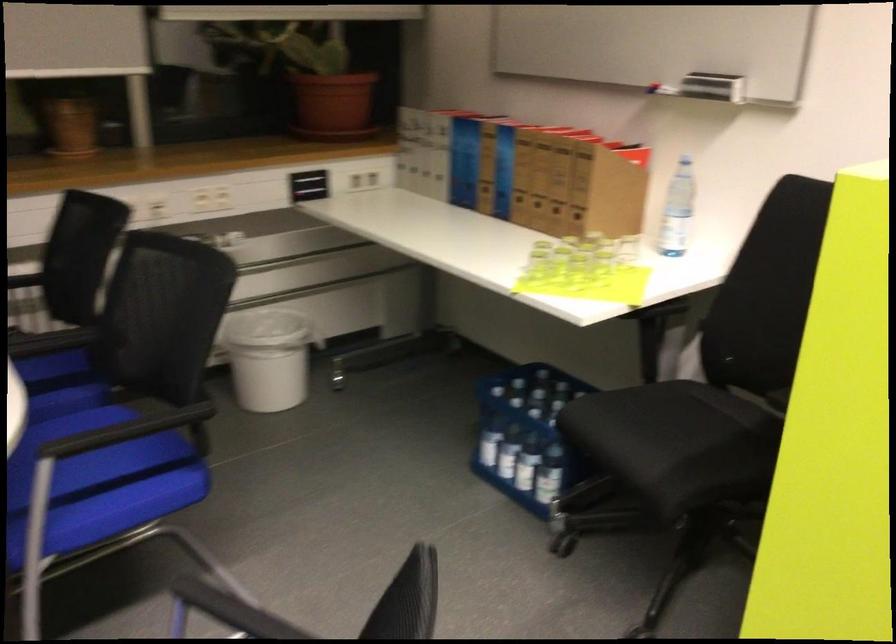
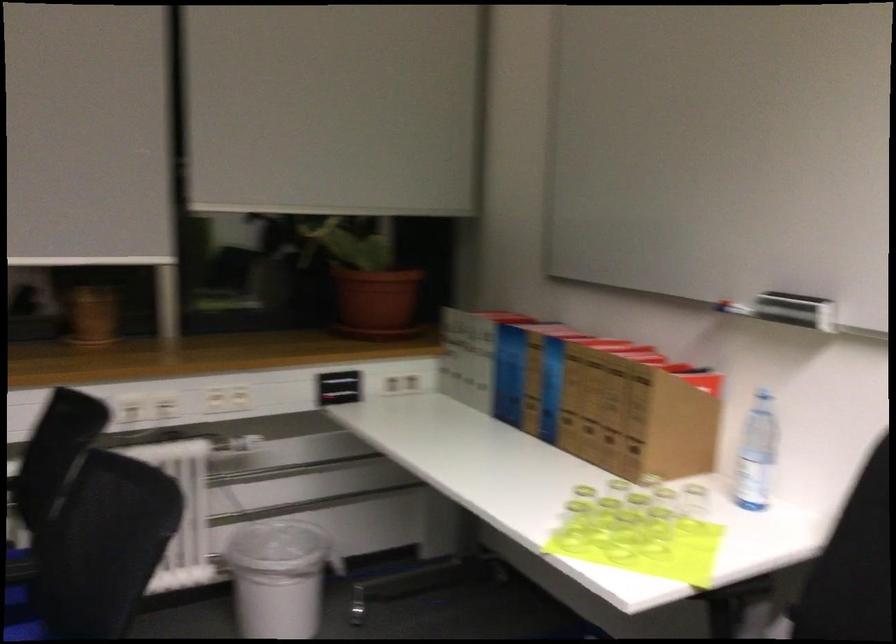
Locate, in the second image, the point that corresponds to pixel 277 353 in the first image.

(278, 576)